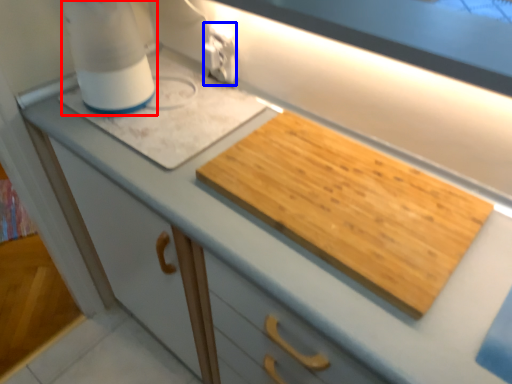
Question: Which object appears farthest to the camera in this image, blender (highlighted by a red box) or electric outlet (highlighted by a blue box)?

Choices:
 (A) blender
 (B) electric outlet

Answer: (B)